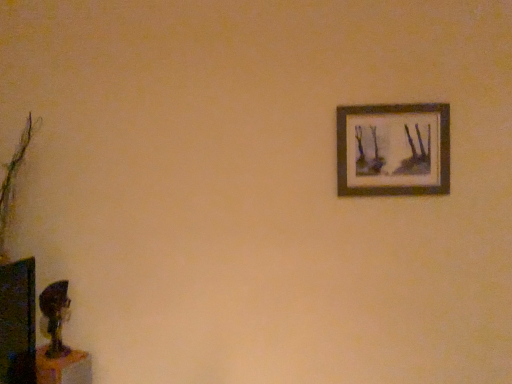
Question: Considering the positions of point (88, 360) and point (439, 148), is point (88, 360) closer or farther from the camera than point (439, 148)?

Choices:
 (A) farther
 (B) closer

Answer: (B)

Question: Is wooden table at lower left in front of or behind wooden frame at upper right in the image?

Choices:
 (A) front
 (B) behind

Answer: (A)

Question: From the image's perspective, is wooden table at lower left positioned above or below wooden frame at upper right?

Choices:
 (A) below
 (B) above

Answer: (A)

Question: Looking at their shapes, would you say wooden frame at upper right is wider or thinner than wooden table at lower left?

Choices:
 (A) wide
 (B) thin

Answer: (B)

Question: Is wooden frame at upper right taller or shorter than wooden table at lower left?

Choices:
 (A) short
 (B) tall

Answer: (B)

Question: Considering the relative positions of wooden frame at upper right and wooden table at lower left in the image provided, is wooden frame at upper right to the left or to the right of wooden table at lower left?

Choices:
 (A) left
 (B) right

Answer: (B)

Question: From a real-world perspective, is wooden frame at upper right above or below wooden table at lower left?

Choices:
 (A) below
 (B) above

Answer: (B)